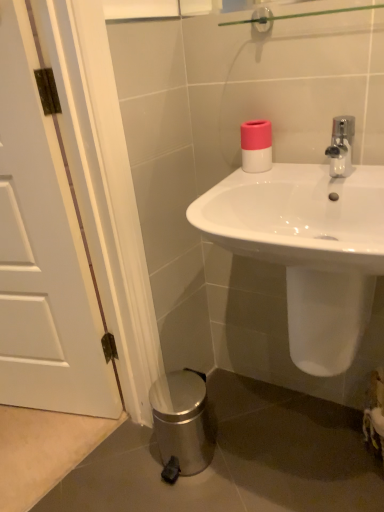
Question: Is white matte door at left positioned with its back to white glossy sink at center?

Choices:
 (A) no
 (B) yes

Answer: (A)

Question: From the image's perspective, is white matte door at left on white glossy sink at center?

Choices:
 (A) no
 (B) yes

Answer: (B)

Question: Is white matte door at left not close to white glossy sink at center?

Choices:
 (A) yes
 (B) no

Answer: (B)

Question: Is white glossy sink at center completely or partially inside white matte door at left?

Choices:
 (A) no
 (B) yes

Answer: (A)

Question: Does white matte door at left have a smaller size compared to white glossy sink at center?

Choices:
 (A) yes
 (B) no

Answer: (A)

Question: Is white matte door at left touching white glossy sink at center?

Choices:
 (A) yes
 (B) no

Answer: (B)

Question: Is white glossy sink at center positioned before white matte door at left?

Choices:
 (A) no
 (B) yes

Answer: (B)

Question: Does white glossy sink at center have a greater width compared to white matte door at left?

Choices:
 (A) yes
 (B) no

Answer: (A)

Question: Is white glossy sink at center at the right side of white matte door at left?

Choices:
 (A) no
 (B) yes

Answer: (B)

Question: From the image's perspective, is white glossy sink at center located above white matte door at left?

Choices:
 (A) no
 (B) yes

Answer: (A)

Question: Is white glossy sink at center next to white matte door at left and touching it?

Choices:
 (A) no
 (B) yes

Answer: (A)

Question: Does white glossy sink at center have a larger size compared to white matte door at left?

Choices:
 (A) yes
 (B) no

Answer: (A)

Question: Would you say white glossy sink at center contains pink matte toilet paper at upper right?

Choices:
 (A) no
 (B) yes

Answer: (A)